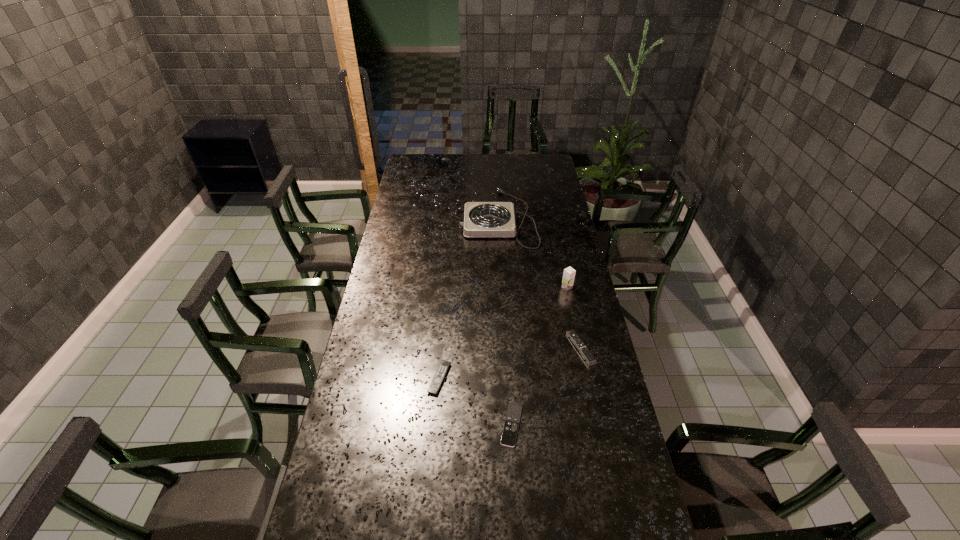
Identify the location of chocolate milk. The height and width of the screenshot is (540, 960). (569, 273).

At what (x,y) coordinates should I click in order to perform the action: click on the tallest object. Please return your answer as a coordinate pair (x, y). Image resolution: width=960 pixels, height=540 pixels. Looking at the image, I should click on (569, 273).

This screenshot has width=960, height=540. What are the coordinates of `the farthest object` in the screenshot? It's located at (481, 219).

This screenshot has height=540, width=960. I want to click on the second tallest object, so click(x=481, y=219).

Identify the location of the tallest remote control. This screenshot has height=540, width=960. (583, 349).

You are a GUI agent. You are given a task and a screenshot of the screen. Output one action in this format:
    pyautogui.click(x=<x>, y=<y>)
    Task: Click on the rightmost remote control
    This screenshot has width=960, height=540.
    Given the screenshot: What is the action you would take?
    pyautogui.click(x=583, y=349)

Where is `the leftmost object`? This screenshot has width=960, height=540. the leftmost object is located at coordinates (439, 376).

What are the coordinates of `the second shortest object` in the screenshot? It's located at (439, 376).

This screenshot has height=540, width=960. What are the coordinates of `the shortest remote control` in the screenshot? It's located at (509, 434).

Locate an element on the screen. The image size is (960, 540). the shortest object is located at coordinates (509, 434).